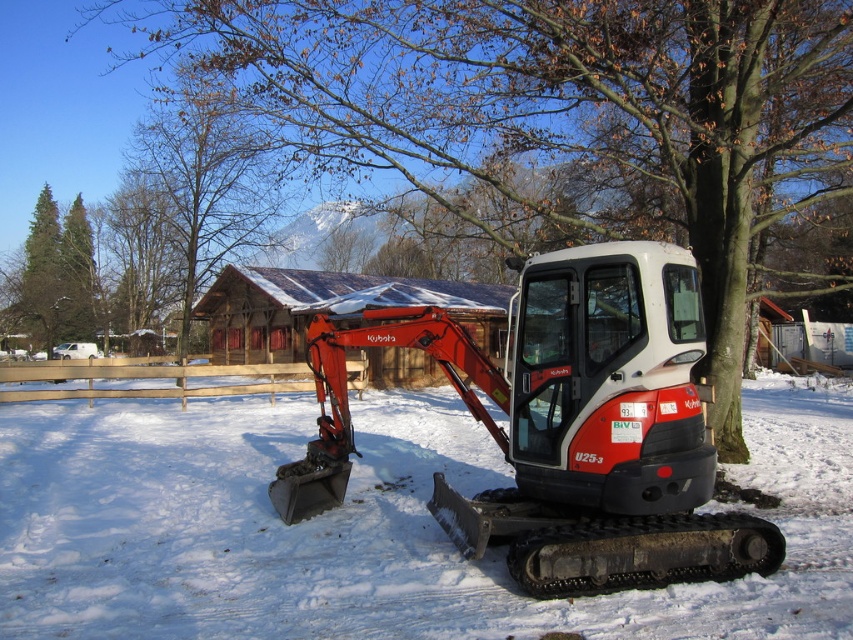
Who is positioned more to the left, bare wood tree at upper center or green coniferous trees at left?

green coniferous trees at left is more to the left.

Identify the location of bare wood tree at upper center. (206, 180).

Who is more distant from viewer, (204, 145) or (50, 220)?

The point (50, 220) is more distant.

Locate an element on the screen. This screenshot has width=853, height=640. bare wood tree at upper center is located at coordinates (206, 180).

Is white powdery snow at center positioned at the back of bare wood tree at upper center?

No, it is not.

Is point (256, 465) farther from camera compared to point (213, 179)?

No, it is in front of (213, 179).

The height and width of the screenshot is (640, 853). I want to click on white powdery snow at center, so click(x=366, y=525).

Describe the element at coordinates (566, 428) in the screenshot. I see `red matte excavator at center` at that location.

Is point (642, 412) closer to viewer compared to point (74, 330)?

That is True.

This screenshot has width=853, height=640. In order to click on red matte excavator at center in this screenshot , I will do `click(566, 428)`.